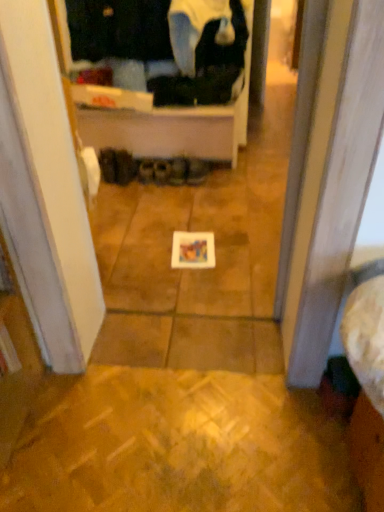
You are a GUI agent. You are given a task and a screenshot of the screen. Output one action in this format:
    pyautogui.click(x=<x>, y=<y>)
    Task: Click on the space that is in front of black fabric shoes at center, marked as the 1th footwear in a left-to-right arrangement
    
    Given the screenshot: What is the action you would take?
    pyautogui.click(x=115, y=190)